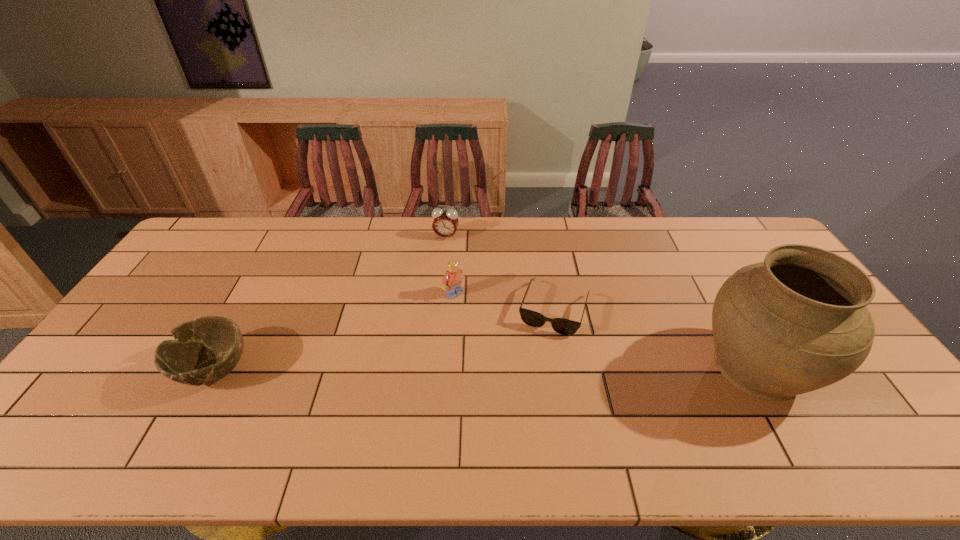
Find the location of a particular element. This screenshot has height=540, width=960. the leftmost object is located at coordinates (204, 350).

You are a GUI agent. You are given a task and a screenshot of the screen. Output one action in this format:
    pyautogui.click(x=<x>, y=<y>)
    Task: Click on the second shortest object
    The image size is (960, 540).
    Given the screenshot: What is the action you would take?
    pyautogui.click(x=204, y=350)

This screenshot has width=960, height=540. What are the coordinates of `the tallest object` in the screenshot? It's located at (797, 322).

Find the location of a particular element. urn is located at coordinates (797, 322).

Locate an element on the screen. sunglasses is located at coordinates (562, 326).

Find the location of a particular element. the shortest object is located at coordinates (562, 326).

The image size is (960, 540). I want to click on the farthest object, so click(x=445, y=223).

The width and height of the screenshot is (960, 540). Identify the location of Lego. (451, 281).

The image size is (960, 540). What are the coordinates of `vacant space located 0.190m on the right of the fourth tallest object` in the screenshot? It's located at (324, 369).

Find the location of a particular element. vacant space located on the back of the urn is located at coordinates (685, 241).